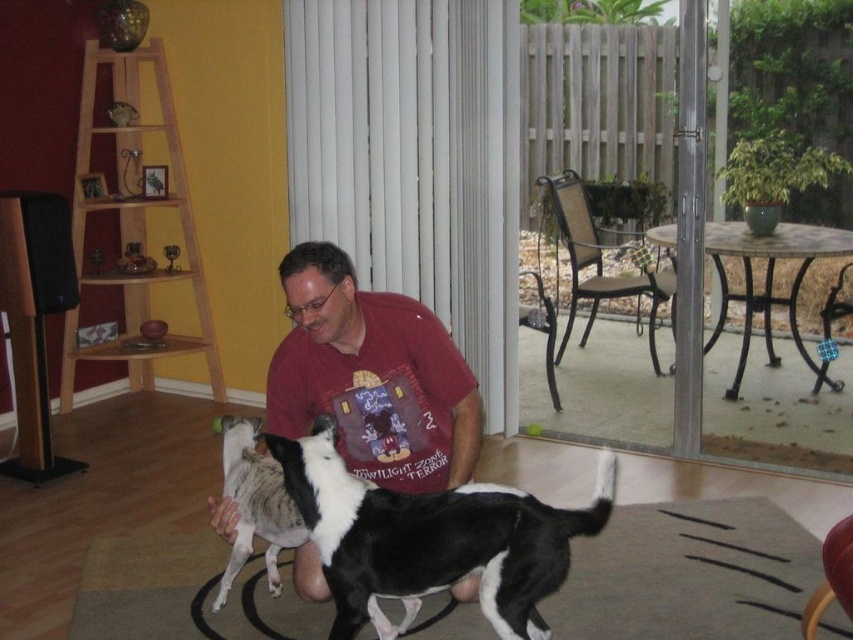
You are a delivery person who needs to enter through the clear glass screen door at right. However, you are carrying a large box that is 1.5 meters tall. Will the black and white fur dog at center block your path when you try to go through the door?

The clear glass screen door at right is much taller than the black and white fur dog at center, so the dog will not block your path when you try to go through the door. However, you should still be cautious as the dog might move out of the way or approach you.

From the picture: You are a visitor standing at the entrance of the room. You want to approach the black and white fur dog at center without stepping on the soft beige rug at lower center. Which direction should you move towards?

The soft beige rug at lower center is further to the viewer than the black and white fur dog at center, so you should move towards the direction of the dog while avoiding the rug by stepping around it since the rug is closer to your current position.